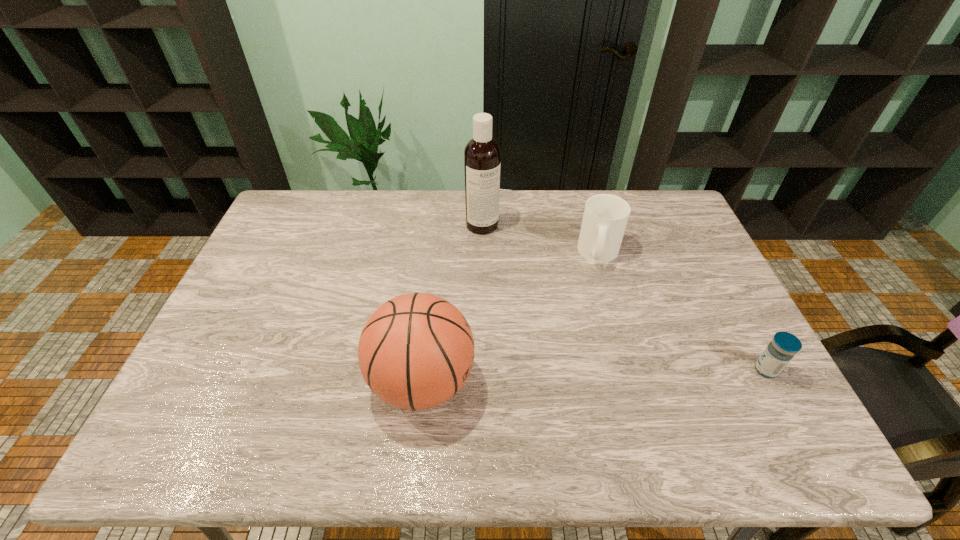
Find the location of a particular element. The image size is (960, 540). blank space located 0.180m on the handle side of the mug is located at coordinates (607, 316).

The image size is (960, 540). Identify the location of free location located on the handle side of the mug. [612, 370].

This screenshot has height=540, width=960. Find the location of `free space located on the label side of the dishwasher detergent`. free space located on the label side of the dishwasher detergent is located at coordinates (505, 254).

At what (x,y) coordinates should I click in order to perform the action: click on vacant area situated 0.100m on the label side of the dishwasher detergent. Please return your answer as a coordinate pair (x, y). The height and width of the screenshot is (540, 960). Looking at the image, I should click on (503, 252).

You are a GUI agent. You are given a task and a screenshot of the screen. Output one action in this format:
    pyautogui.click(x=<x>, y=<y>)
    Task: Click on the vacant area situated 0.110m on the label side of the dishwasher detergent
    
    Given the screenshot: What is the action you would take?
    pyautogui.click(x=505, y=254)

I want to click on object present at the far edge, so click(482, 155).

I want to click on basketball at the near edge, so click(416, 351).

This screenshot has height=540, width=960. Identify the location of medicine present at the near edge. (784, 345).

The width and height of the screenshot is (960, 540). Find the location of `object present at the right edge`. object present at the right edge is located at coordinates (784, 345).

The height and width of the screenshot is (540, 960). Find the location of `object located in the near right corner section of the desktop`. object located in the near right corner section of the desktop is located at coordinates coord(784,345).